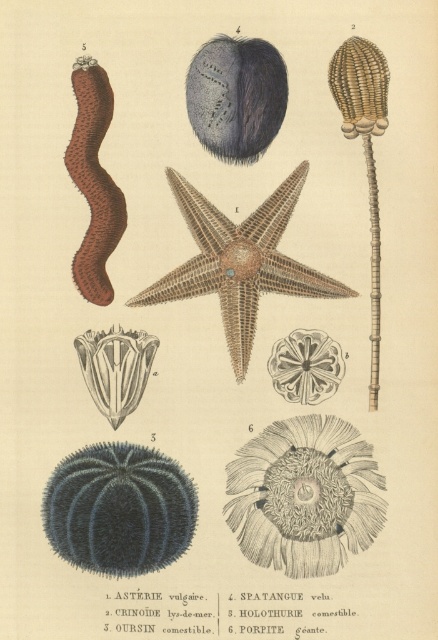
You are an art conservator examining the botanical illustration. You need to determine if a protective sheet labeled as white paper at center can fully cover the fuzzy dark blue sea urchin at center. Based on their sizes, what is your conclusion?

The white paper at center is larger in size than the fuzzy dark blue sea urchin at center, so it can fully cover it.

You are an underwater photographer aiming to capture both the blue spiny sea urchin at upper left and the fuzzy dark blue sea urchin at center in a single frame. Based on their positions and sizes, which one should you focus on first to ensure both fit in the shot?

The blue spiny sea urchin at upper left might be wider than the fuzzy dark blue sea urchin at center, so focusing on the larger one first would help ensure both fit in the frame.

You are an underwater explorer looking at the illustration. You see the fuzzy dark blue sea urchin at center and the brown fuzzy worm at upper left. Which of these two organisms is positioned higher in the image?

The fuzzy dark blue sea urchin at center is positioned higher in the image than the brown fuzzy worm at upper left.